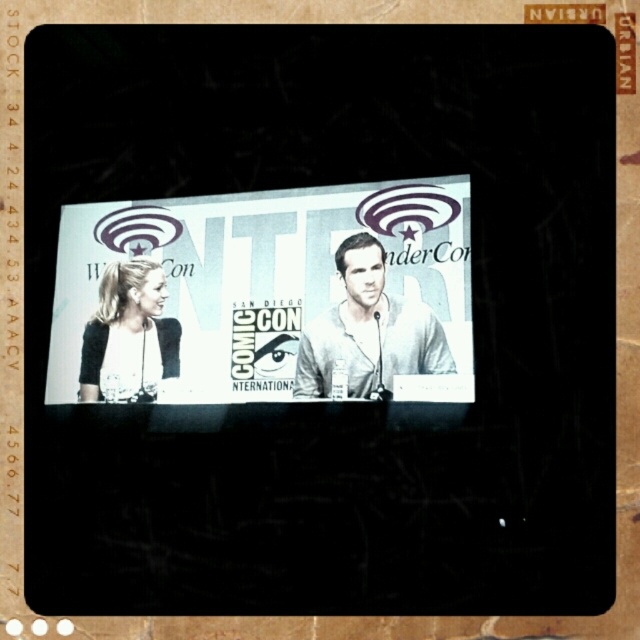
Which is behind, point (387, 332) or point (336, 340)?

The point (336, 340) is behind.

Is white paper poster at center thinner than light gray shirt at center?

No.

This screenshot has width=640, height=640. What are the coordinates of `white paper poster at center` in the screenshot? It's located at (266, 296).